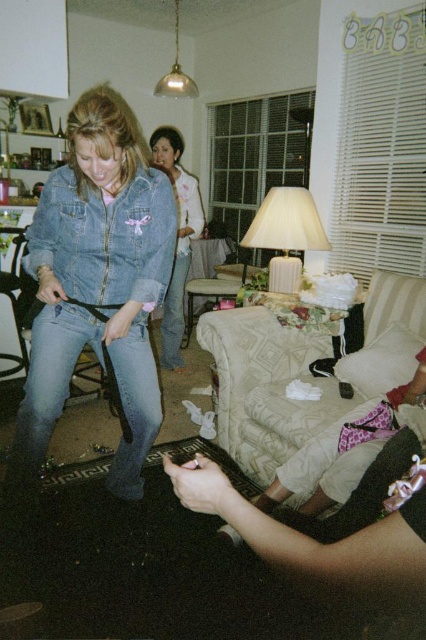
Does denim jeans at lower left appear on the right side of denim jacket at center?

No, denim jeans at lower left is not to the right of denim jacket at center.

Can you confirm if denim jeans at lower left is bigger than denim jacket at center?

Result: Incorrect, denim jeans at lower left is not larger than denim jacket at center.

At what (x,y) coordinates should I click in order to perform the action: click on denim jeans at lower left. Please return your answer as a coordinate pair (x, y). The height and width of the screenshot is (640, 426). Looking at the image, I should click on (68, 392).

Locate an element on the screen. This screenshot has width=426, height=640. denim jeans at lower left is located at coordinates (68, 392).

Who is more distant from viewer, (x=259, y=442) or (x=178, y=314)?

The point (x=178, y=314) is behind.

Can you confirm if beige fabric couch at lower center is taller than denim at left?

Yes.

Describe the element at coordinates (313, 381) in the screenshot. I see `beige fabric couch at lower center` at that location.

Find the location of `beige fabric couch at lower center`. beige fabric couch at lower center is located at coordinates [313, 381].

Is point (135, 332) closer to camera compared to point (173, 364)?

That is True.

Measure the distance between denim jeans at lower left and camera.

denim jeans at lower left and camera are 1.74 meters apart.

The height and width of the screenshot is (640, 426). In order to click on denim jeans at lower left in this screenshot , I will do `click(68, 392)`.